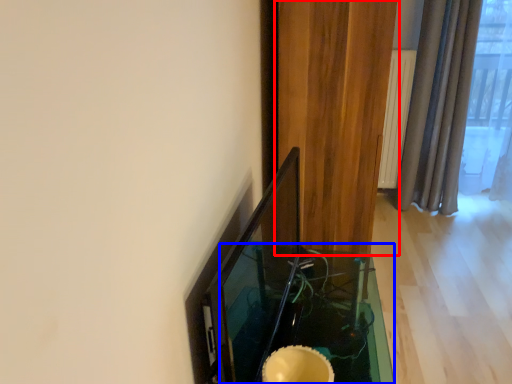
Question: Which object appears closest to the camera in this image, curtain (highlighted by a red box) or table (highlighted by a blue box)?

Choices:
 (A) curtain
 (B) table

Answer: (B)